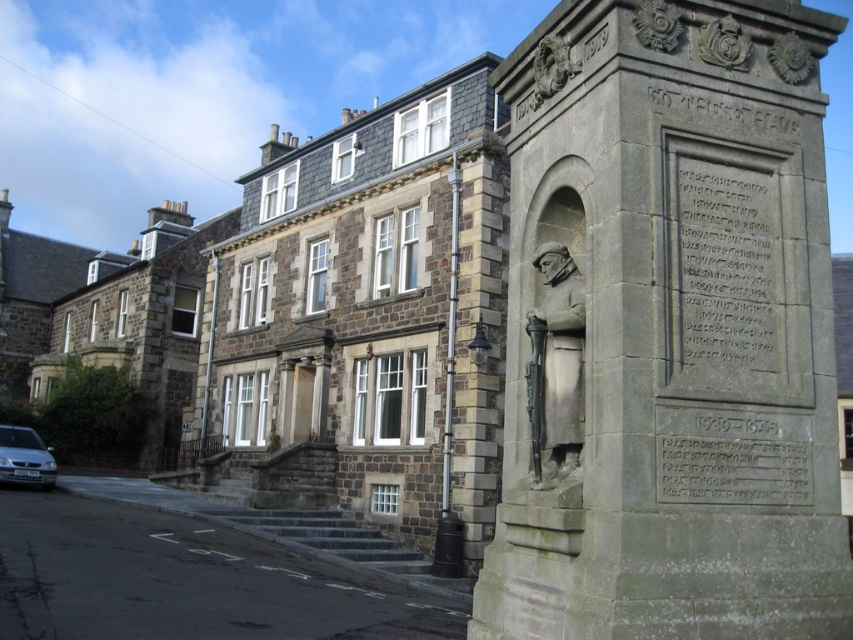
Does bronze statue at right appear on the left side of silver metallic car at lower left?

Incorrect, bronze statue at right is not on the left side of silver metallic car at lower left.

Identify the location of bronze statue at right. The image size is (853, 640). (672, 332).

You are a GUI agent. You are given a task and a screenshot of the screen. Output one action in this format:
    pyautogui.click(x=<x>, y=<y>)
    Task: Click on the bronze statue at right
    The height and width of the screenshot is (640, 853).
    Given the screenshot: What is the action you would take?
    (x=672, y=332)

Between black stone inscription at center and bronze statue at center, which one is positioned higher?

black stone inscription at center is higher up.

Does black stone inscription at center appear over bronze statue at center?

Yes.

Is point (746, 369) closer to camera compared to point (527, 376)?

Yes, it is in front of point (527, 376).

Find the location of a particular element. black stone inscription at center is located at coordinates (726, 268).

Is bronze statue at right above carved stone inscription at upper right?

No.

Where is `bronze statue at right`? bronze statue at right is located at coordinates (672, 332).

Find the location of a particular element. bronze statue at right is located at coordinates (672, 332).